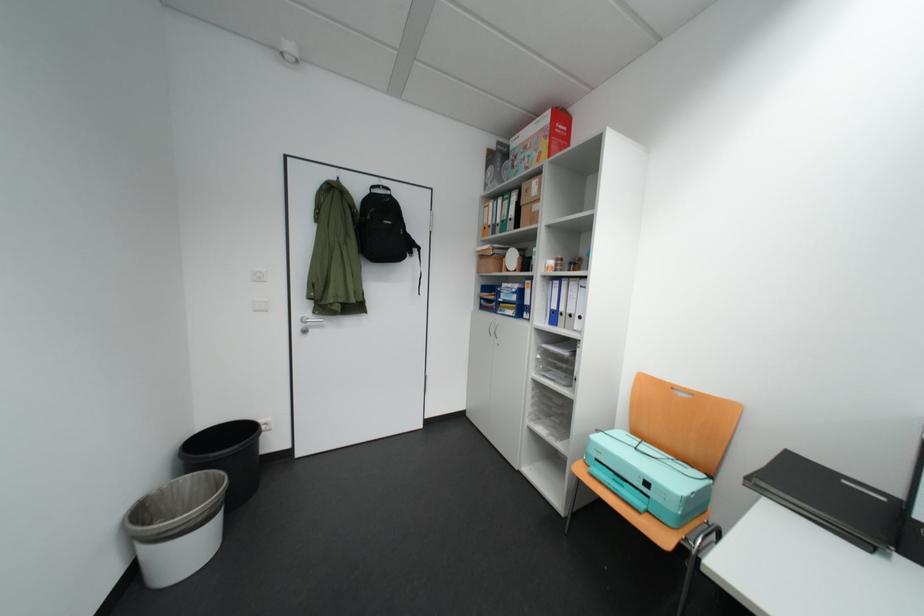
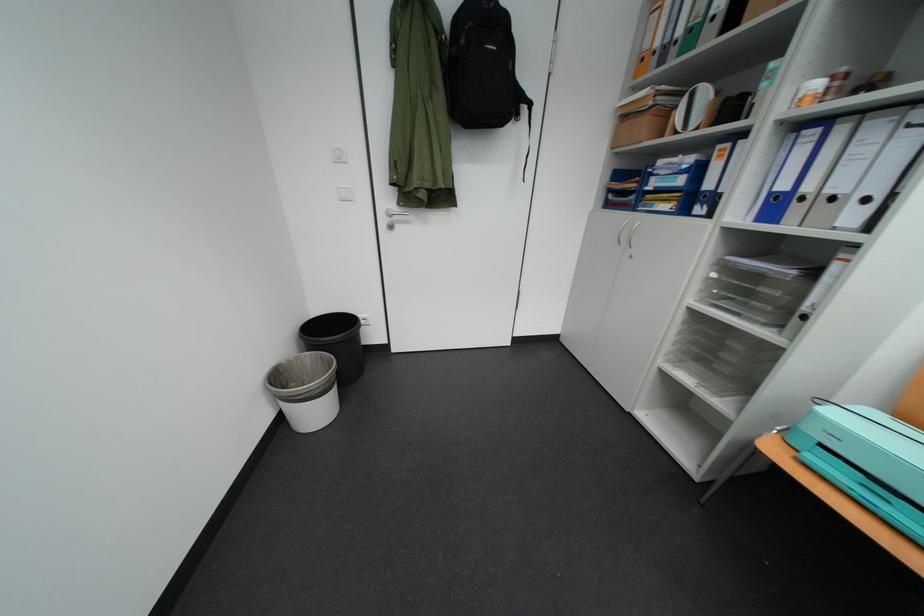
The point at [422,254] is marked in the first image. Where is the corresponding point in the second image?

(529, 116)